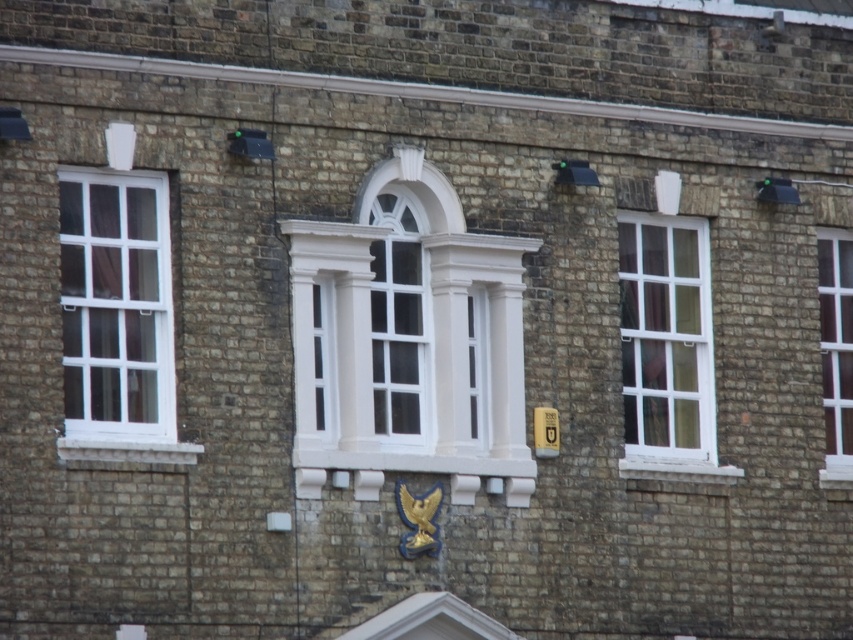
Question: Is white glossy window at center to the right of white plastic window at left from the viewer's perspective?

Choices:
 (A) no
 (B) yes

Answer: (B)

Question: Can you confirm if white glossy window at center is positioned to the right of white plastic window at left?

Choices:
 (A) no
 (B) yes

Answer: (B)

Question: Estimate the real-world distances between objects in this image. Which object is closer to the white wooden window at center?

Choices:
 (A) white glass window at right
 (B) white glossy window at center
 (C) white plastic window at left

Answer: (A)

Question: Which point is closer to the camera taking this photo?

Choices:
 (A) (134, 259)
 (B) (851, 403)
 (C) (708, 380)

Answer: (A)

Question: Which point is farther to the camera?

Choices:
 (A) white wooden window at center
 (B) white glass window at right
 (C) white plastic window at left

Answer: (B)

Question: In this image, where is white glossy window at center located relative to white wooden window at center?

Choices:
 (A) left
 (B) right

Answer: (A)